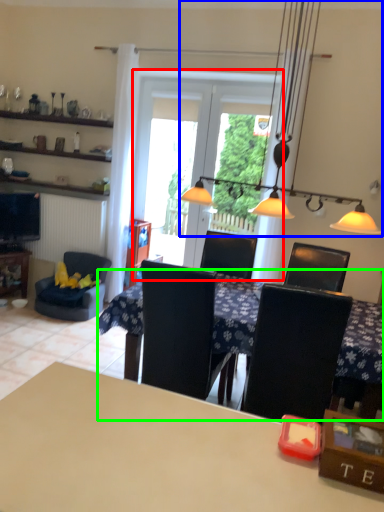
Question: Which object is the closest to the screen door (highlighted by a red box)? Choose among these: light fixture (highlighted by a blue box) or table (highlighted by a green box).

Choices:
 (A) light fixture
 (B) table

Answer: (A)